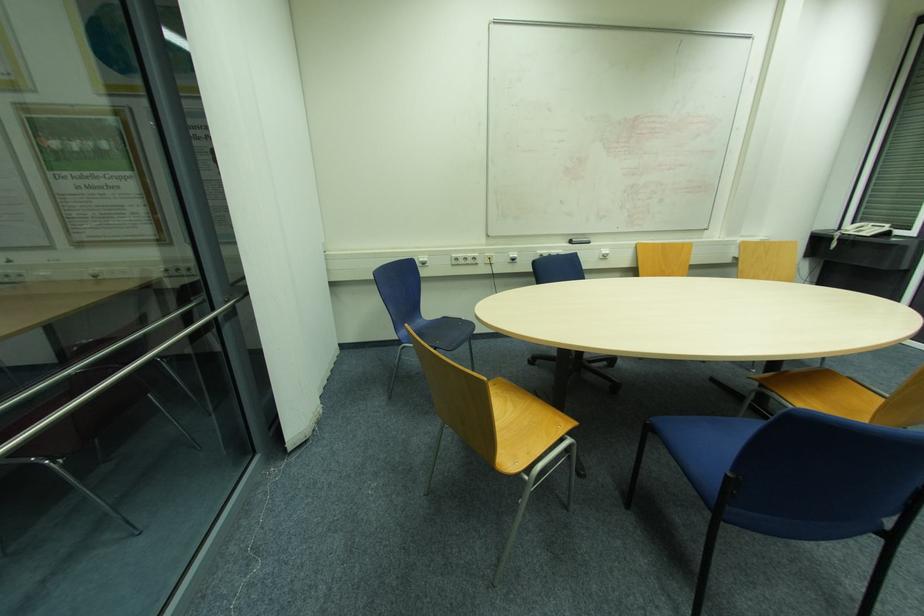
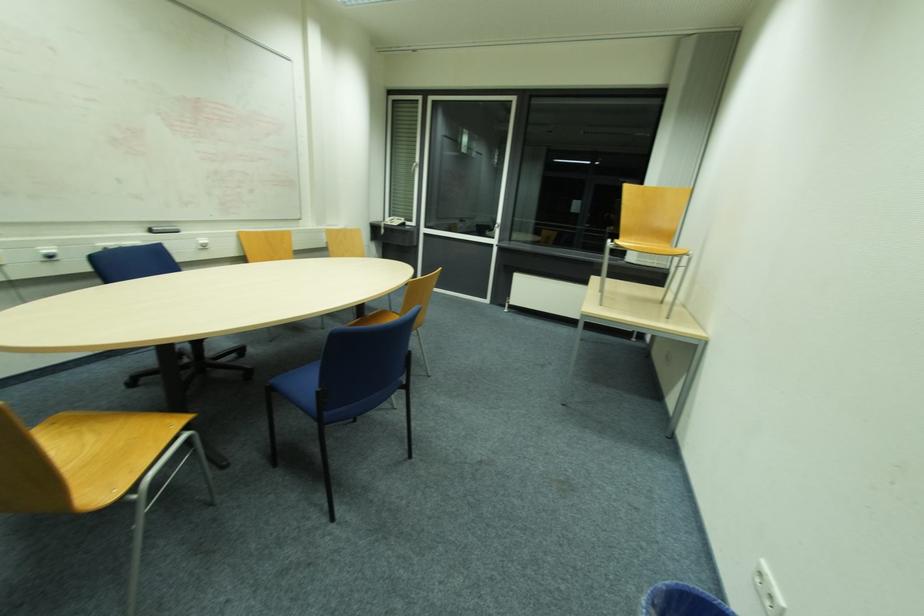
Question: The camera is either moving clockwise (left) or counter-clockwise (right) around the object. The first image is from the beginning of the video and the second image is from the end. Is the camera moving left or right when shooting the video?

Choices:
 (A) Left
 (B) Right

Answer: (A)